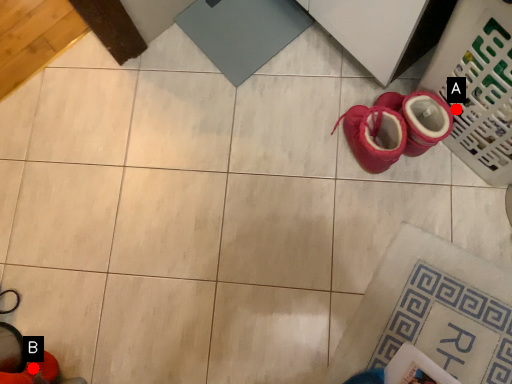
Question: Two points are circled on the image, labeled by A and B beside each circle. Which of the following is the closest to the observer?

Choices:
 (A) A is closer
 (B) B is closer

Answer: (A)